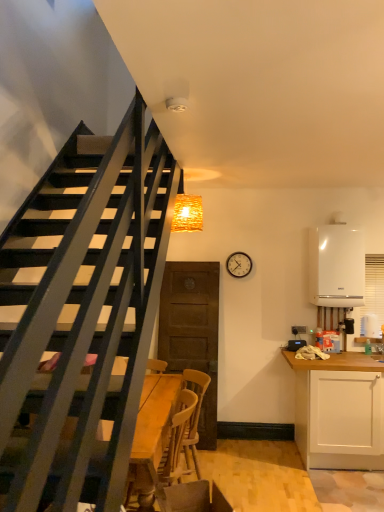
What do you see at coordinates (336, 266) in the screenshot? This screenshot has height=512, width=384. I see `white glossy boiler at right` at bounding box center [336, 266].

I want to click on woven wood light fixture at upper center, so click(x=187, y=210).

The width and height of the screenshot is (384, 512). What are the coordinates of `white matte cabinet at right` in the screenshot? It's located at (338, 410).

Locate an element on the screen. This screenshot has height=512, width=384. metallic round clock at upper right is located at coordinates (239, 264).

Measure the distance between wooden at lower center and camera.

wooden at lower center is 8.19 feet away from camera.

What do you see at coordinates (192, 497) in the screenshot? This screenshot has height=512, width=384. I see `wooden swivel chair at lower center` at bounding box center [192, 497].

The image size is (384, 512). What are the coordinates of `white glossy boiler at right` in the screenshot? It's located at (336, 266).

Looking at this image, considering the sizes of objects white matte cabinet at right and wooden swivel chair at lower center in the image provided, who is taller, white matte cabinet at right or wooden swivel chair at lower center?

white matte cabinet at right is taller.

Which is correct: white matte cabinet at right is inside wooden swivel chair at lower center, or outside of it?

white matte cabinet at right lies outside wooden swivel chair at lower center.

The image size is (384, 512). What are the coordinates of `cabinetry positioned vertically above the wooden swivel chair at lower center (from a real-world perspective)` in the screenshot? It's located at (338, 410).

From their relative heights in the image, would you say white matte cabinet at right is taller or shorter than white glossy boiler at right?

In the image, white matte cabinet at right appears to be taller than white glossy boiler at right.

Can you confirm if white matte cabinet at right is wider than white glossy boiler at right?

Correct, the width of white matte cabinet at right exceeds that of white glossy boiler at right.

Does white matte cabinet at right turn towards white glossy boiler at right?

No, white matte cabinet at right is not aimed at white glossy boiler at right.

Which of these two, wooden at lower center or woven wood light fixture at upper center, is bigger?

With larger size is wooden at lower center.

You are a GUI agent. You are given a task and a screenshot of the screen. Output one action in this format:
    pyautogui.click(x=<x>, y=<y>)
    Task: Click on the light fixture on the right of the wooden at lower center
    
    Given the screenshot: What is the action you would take?
    pyautogui.click(x=187, y=210)

Between wooden at lower center and woven wood light fixture at upper center, which one is positioned behind?

woven wood light fixture at upper center.

Is wooden at lower center not inside woven wood light fixture at upper center?

Absolutely, wooden at lower center is external to woven wood light fixture at upper center.

Is woven wood light fixture at upper center positioned beyond the bounds of white glossy boiler at right?

→ Indeed, woven wood light fixture at upper center is completely outside white glossy boiler at right.

Is woven wood light fixture at upper center far away from white glossy boiler at right?

Yes.

Can you confirm if woven wood light fixture at upper center is wider than white glossy boiler at right?

No, woven wood light fixture at upper center is not wider than white glossy boiler at right.

Is white glossy boiler at right not close to white matte cabinet at right?

They are positioned close to each other.

From the image's perspective, who appears lower, white glossy boiler at right or white matte cabinet at right?

white matte cabinet at right is shown below in the image.

Which of these two, white glossy boiler at right or white matte cabinet at right, stands taller?

white matte cabinet at right is taller.

Looking at this image, from a real-world perspective, which is physically above, white glossy boiler at right or white matte cabinet at right?

In real-world perspective, white glossy boiler at right is above.

Which of these two, wooden swivel chair at lower center or wooden at lower center, is thinner?

With smaller width is wooden swivel chair at lower center.

Considering the positions of objects wooden swivel chair at lower center and wooden at lower center in the image provided, who is behind, wooden swivel chair at lower center or wooden at lower center?

wooden at lower center is behind.

Does point (172, 509) lie behind point (168, 466)?

No, (172, 509) is closer to viewer.

Is wooden swivel chair at lower center inside the boundaries of wooden at lower center, or outside?

wooden swivel chair at lower center exists outside the volume of wooden at lower center.

Based on the photo, from the image's perspective, is white glossy boiler at right positioned above or below wooden swivel chair at lower center?

Based on their image positions, white glossy boiler at right is located above wooden swivel chair at lower center.

From a real-world perspective, relative to wooden swivel chair at lower center, is white glossy boiler at right vertically above or below?

In terms of real-world spatial position, white glossy boiler at right is above wooden swivel chair at lower center.

Would you say wooden swivel chair at lower center is part of white glossy boiler at right's contents?

No, wooden swivel chair at lower center is not inside white glossy boiler at right.

Considering the sizes of objects white glossy boiler at right and wooden swivel chair at lower center in the image provided, who is wider, white glossy boiler at right or wooden swivel chair at lower center?

wooden swivel chair at lower center is wider.

Image resolution: width=384 pixels, height=512 pixels. Find the location of `swivel chair lying in front of the white matte cabinet at right`. swivel chair lying in front of the white matte cabinet at right is located at coordinates point(192,497).

Image resolution: width=384 pixels, height=512 pixels. What are the coordinates of `appliance located behind the white matte cabinet at right` in the screenshot? It's located at (336, 266).

Estimate the real-world distances between objects in this image. Which object is closer to woven wood light fixture at upper center, wooden swivel chair at lower center or metallic round clock at upper right?

metallic round clock at upper right.

Based on their spatial positions, is wooden at lower center or metallic round clock at upper right closer to white matte cabinet at right?

wooden at lower center.

Which object lies further to the anchor point white matte cabinet at right, metallic round clock at upper right or woven wood light fixture at upper center?

Among the two, woven wood light fixture at upper center is located further to white matte cabinet at right.

When comparing their distances from wooden at lower center, does white matte cabinet at right or wooden swivel chair at lower center seem closer?

wooden swivel chair at lower center is positioned closer to the anchor wooden at lower center.

Looking at the image, which one is located further to woven wood light fixture at upper center, wooden at lower center or metallic round clock at upper right?

wooden at lower center.

Considering their positions, is wooden swivel chair at lower center positioned closer to white glossy boiler at right than woven wood light fixture at upper center?

woven wood light fixture at upper center is positioned closer to the anchor white glossy boiler at right.

From the image, which object appears to be nearer to wooden at lower center, white glossy boiler at right or wooden swivel chair at lower center?

Based on the image, wooden swivel chair at lower center appears to be nearer to wooden at lower center.

Based on their spatial positions, is white glossy boiler at right or woven wood light fixture at upper center closer to wooden at lower center?

woven wood light fixture at upper center is positioned closer to the anchor wooden at lower center.

Locate an element on the screen. chair between woven wood light fixture at upper center and wooden swivel chair at lower center vertically is located at coordinates (178, 438).

Locate an element on the screen. This screenshot has height=512, width=384. cabinetry between wooden at lower center and white glossy boiler at right is located at coordinates (338, 410).

Locate an element on the screen. light fixture between wooden swivel chair at lower center and white glossy boiler at right from front to back is located at coordinates (187, 210).

I want to click on chair located between wooden swivel chair at lower center and metallic round clock at upper right in the depth direction, so click(x=178, y=438).